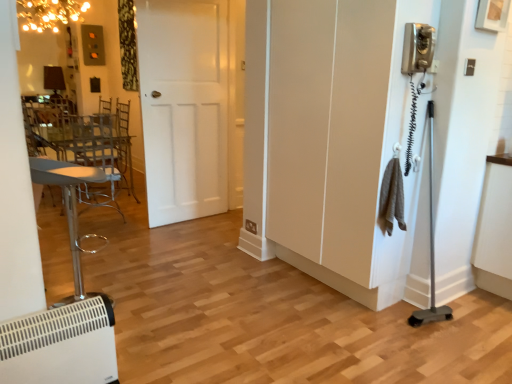
Question: From a real-world perspective, is white plastic heater at lower left physically located above or below white matte screen door at right?

Choices:
 (A) above
 (B) below

Answer: (B)

Question: Considering the positions of white plastic heater at lower left and white matte screen door at right in the image, is white plastic heater at lower left wider or thinner than white matte screen door at right?

Choices:
 (A) wide
 (B) thin

Answer: (B)

Question: Based on their relative distances, which object is nearer to the white matte screen door at right?

Choices:
 (A) white matte door at center
 (B) white plastic heater at lower left
 (C) metallic silver swivel chair at left
 (D) white plastic heater at lower left

Answer: (A)

Question: Which object is the farthest from the white matte door at center?

Choices:
 (A) metallic silver swivel chair at left
 (B) white matte screen door at right
 (C) white plastic heater at lower left
 (D) white plastic heater at lower left

Answer: (D)